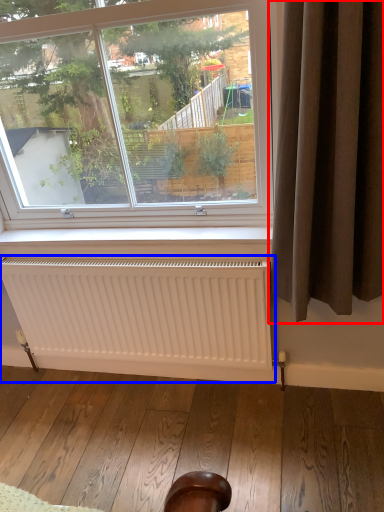
Question: Among these objects, which one is farthest to the camera, curtain (highlighted by a red box) or radiator (highlighted by a blue box)?

Choices:
 (A) curtain
 (B) radiator

Answer: (B)